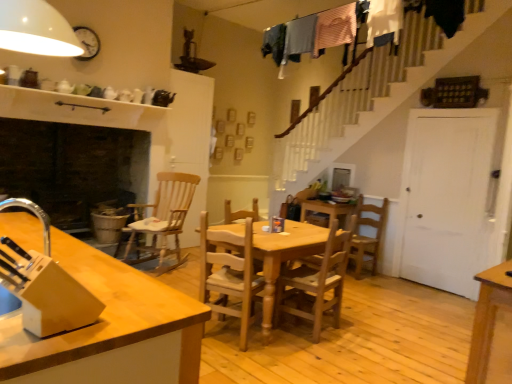
Describe the element at coordinates (367, 236) in the screenshot. I see `wooden chair at center, marked as the first chair in a right-to-left arrangement` at that location.

This screenshot has height=384, width=512. I want to click on light brown wooden chair at center, marked as the 3th chair in a right-to-left arrangement, so click(230, 278).

Measure the distance between wooden rocking chair at center-left, which is counted as the 1th chair, starting from the left, and camera.

16.02 feet.

Where is `wooden table at center`? This screenshot has width=512, height=384. wooden table at center is located at coordinates (282, 270).

Find the location of a particular element. wooden chair at center, marked as the first chair in a right-to-left arrangement is located at coordinates (367, 236).

Consider the image. Are wooden chair at center, positioned as the fourth chair in front-to-back order, and light brown wooden chair at center, marked as the 3th chair in a right-to-left arrangement, far apart?

That's right, there is a large distance between wooden chair at center, positioned as the fourth chair in front-to-back order, and light brown wooden chair at center, marked as the 3th chair in a right-to-left arrangement.

Can we say wooden chair at center, which is counted as the fourth chair, starting from the left, lies outside light brown wooden chair at center, the 4th chair positioned from the back?

Absolutely, wooden chair at center, which is counted as the fourth chair, starting from the left, is external to light brown wooden chair at center, the 4th chair positioned from the back.

Considering the positions of objects wooden chair at center, positioned as the fourth chair in front-to-back order, and light brown wooden chair at center, which is counted as the 1th chair, starting from the front, in the image provided, who is more to the left, wooden chair at center, positioned as the fourth chair in front-to-back order, or light brown wooden chair at center, which is counted as the 1th chair, starting from the front,?

Positioned to the left is light brown wooden chair at center, which is counted as the 1th chair, starting from the front.

Based on the photo, between wooden chair at center, the first chair when ordered from back to front, and light brown wooden chair at center, the 2th chair positioned from the left, which one has smaller size?

light brown wooden chair at center, the 2th chair positioned from the left.

Would you consider light brown wood at left to be distant from light brown wooden chair at center, the 4th chair positioned from the back?

Yes, light brown wood at left and light brown wooden chair at center, the 4th chair positioned from the back, are located far from each other.

Locate an element on the screen. chair that is the 1st object located behind the light brown wood at left is located at coordinates click(230, 278).

Does light brown wood at left have a greater height compared to light brown wooden chair at center, the 4th chair positioned from the back?

No, light brown wood at left is not taller than light brown wooden chair at center, the 4th chair positioned from the back.

Is wooden table at center at the back of light brown wood at left?

No, light brown wood at left is not facing away from wooden table at center.

From a real-world perspective, is light brown wood at left above or below wooden table at center?

In terms of real-world spatial position, light brown wood at left is above wooden table at center.

Considering the sizes of objects light brown wood at left and wooden table at center in the image provided, who is smaller, light brown wood at left or wooden table at center?

Smaller between the two is wooden table at center.

Is wooden table at center completely or partially inside light brown wood at left?

No, wooden table at center is located outside of light brown wood at left.

Looking at this image, considering the sizes of objects wooden chair at center, which is counted as the fourth chair, starting from the left, and wooden table at center in the image provided, who is bigger, wooden chair at center, which is counted as the fourth chair, starting from the left, or wooden table at center?

Bigger between the two is wooden table at center.

From a real-world perspective, is wooden chair at center, positioned as the fourth chair in front-to-back order, positioned over wooden table at center based on gravity?

Yes, from a real-world perspective, wooden chair at center, positioned as the fourth chair in front-to-back order, is above wooden table at center.

Is wooden table at center a part of wooden chair at center, positioned as the fourth chair in front-to-back order?

No, wooden chair at center, positioned as the fourth chair in front-to-back order, does not contain wooden table at center.

Between wooden chair at center, which is counted as the fourth chair, starting from the left, and wooden table at center, which one appears on the left side from the viewer's perspective?

wooden table at center is more to the left.

Does point (307, 253) lie in front of point (124, 270)?

No, it is behind (124, 270).

Considering the sizes of objects wooden table at center and light brown wood at left in the image provided, who is smaller, wooden table at center or light brown wood at left?

Smaller between the two is wooden table at center.

Is wooden table at center in front of or behind light brown wood at left in the image?

Visually, wooden table at center is located behind light brown wood at left.

From the image's perspective, is wooden table at center located above or below light brown wood at left?

Based on their image positions, wooden table at center is located above light brown wood at left.

From the picture: Which of these two, wooden table at center or light brown wooden chair at center, the 2th chair positioned from the left, stands shorter?

wooden table at center.

Looking at this image, between wooden table at center and light brown wooden chair at center, the 2th chair positioned from the left, which one appears on the right side from the viewer's perspective?

Positioned to the right is wooden table at center.

This screenshot has width=512, height=384. Find the location of `chair in front of the wooden table at center`. chair in front of the wooden table at center is located at coordinates (230, 278).

Is point (316, 240) more distant than point (242, 314)?

Yes.

Is wooden rocking chair at center-left, which is counted as the 1th chair, starting from the left, positioned with its back to wooden table at center?

wooden rocking chair at center-left, which is counted as the 1th chair, starting from the left, is not turned away from wooden table at center.

Which of these two, wooden rocking chair at center-left, the second chair viewed from the back, or wooden table at center, stands taller?

Standing taller between the two is wooden rocking chair at center-left, the second chair viewed from the back.

Measure the distance between wooden rocking chair at center-left, positioned as the third chair in front-to-back order, and wooden table at center.

They are 6.44 feet apart.

Considering the relative sizes of wooden rocking chair at center-left, which is counted as the 1th chair, starting from the left, and wooden table at center in the image provided, is wooden rocking chair at center-left, which is counted as the 1th chair, starting from the left, smaller than wooden table at center?

Yes, wooden rocking chair at center-left, which is counted as the 1th chair, starting from the left, is smaller than wooden table at center.

Which chair is the 3rd one when counting from the back of the light brown wooden chair at center, the 4th chair positioned from the back? Please provide its 2D coordinates.

[(367, 236)]

Where is `countertop below the light brown wooden chair at center, marked as the 3th chair in a right-to-left arrangement (from the image's perspective)`? countertop below the light brown wooden chair at center, marked as the 3th chair in a right-to-left arrangement (from the image's perspective) is located at coordinates (110, 329).

Considering their positions, is wooden table at center positioned closer to light brown wooden chair at center, which is counted as the 1th chair, starting from the front, than wooden chair at center, the 3th chair positioned from the back?

wooden table at center lies closer to light brown wooden chair at center, which is counted as the 1th chair, starting from the front, than the other object.

Looking at this image, when comparing their distances from wooden chair at center, the 3th chair positioned from the back, does light brown wooden chair at center, marked as the 3th chair in a right-to-left arrangement, or wooden rocking chair at center-left, positioned as the fourth chair in right-to-left order, seem closer?

Among the two, light brown wooden chair at center, marked as the 3th chair in a right-to-left arrangement, is located nearer to wooden chair at center, the 3th chair positioned from the back.

Estimate the real-world distances between objects in this image. Which object is further from wooden rocking chair at center-left, positioned as the fourth chair in right-to-left order, wooden chair at center, the 3th chair from the left, or light brown wood at left?

light brown wood at left is further to wooden rocking chair at center-left, positioned as the fourth chair in right-to-left order.

Estimate the real-world distances between objects in this image. Which object is further from wooden chair at center, positioned as the fourth chair in front-to-back order, light brown wooden chair at center, the 2th chair positioned from the left, or light brown wood at left?

light brown wood at left is further to wooden chair at center, positioned as the fourth chair in front-to-back order.

Estimate the real-world distances between objects in this image. Which object is closer to light brown wood at left, wooden chair at center, the 3th chair positioned from the back, or wooden chair at center, the first chair when ordered from back to front?

The object closer to light brown wood at left is wooden chair at center, the 3th chair positioned from the back.

When comparing their distances from wooden rocking chair at center-left, positioned as the fourth chair in right-to-left order, does wooden chair at center, arranged as the 2th chair when viewed from the right, or wooden table at center seem further?

wooden chair at center, arranged as the 2th chair when viewed from the right.

Which object lies further to the anchor point light brown wooden chair at center, which is counted as the 1th chair, starting from the front, wooden chair at center, marked as the first chair in a right-to-left arrangement, or wooden chair at center, the second chair positioned from the front?

wooden chair at center, marked as the first chair in a right-to-left arrangement, is positioned further to the anchor light brown wooden chair at center, which is counted as the 1th chair, starting from the front.

Considering their positions, is light brown wooden chair at center, the 4th chair positioned from the back, positioned closer to wooden table at center than wooden chair at center, arranged as the 2th chair when viewed from the right?

wooden chair at center, arranged as the 2th chair when viewed from the right.

The height and width of the screenshot is (384, 512). I want to click on kitchen & dining room table located between light brown wooden chair at center, which is counted as the 1th chair, starting from the front, and wooden chair at center, arranged as the 2th chair when viewed from the right, in the left-right direction, so click(x=282, y=270).

The image size is (512, 384). What are the coordinates of `kitchen & dining room table positioned between light brown wooden chair at center, which is counted as the 1th chair, starting from the front, and wooden rocking chair at center-left, the second chair viewed from the back, from near to far` in the screenshot? It's located at [282, 270].

Where is `chair between light brown wood at left and wooden table at center in the front-back direction`? chair between light brown wood at left and wooden table at center in the front-back direction is located at coordinates (230, 278).

In order to click on kitchen & dining room table between light brown wood at left and wooden rocking chair at center-left, which is counted as the 1th chair, starting from the left, along the z-axis in this screenshot , I will do click(282, 270).